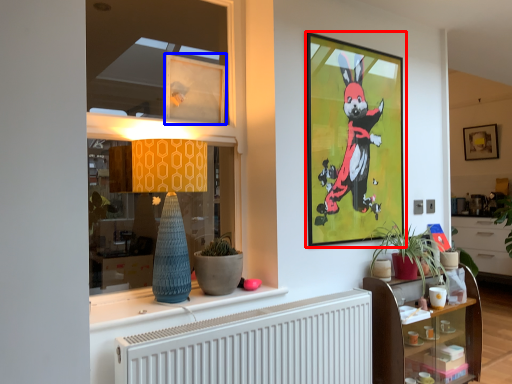
Question: Which object appears farthest to the camera in this image, picture frame (highlighted by a red box) or picture frame (highlighted by a blue box)?

Choices:
 (A) picture frame
 (B) picture frame

Answer: (A)